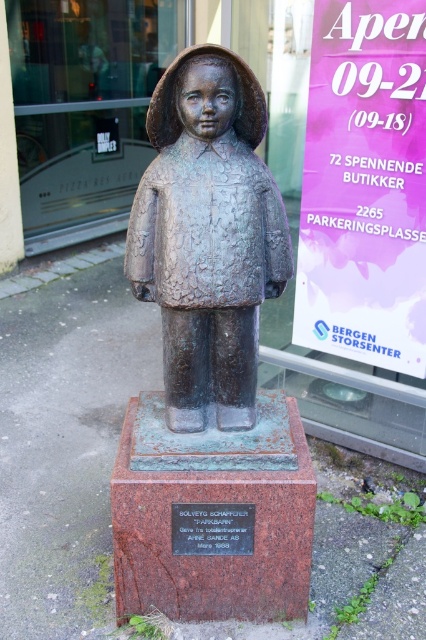
Is bronze statue at center behind bronze plaque at center?

No, bronze statue at center is in front of bronze plaque at center.

Does point (184, 369) come behind point (178, 515)?

Yes, point (184, 369) is farther from viewer.

Does point (196, 168) come farther from viewer compared to point (210, 512)?

That is False.

Where is `bronze statue at center`? This screenshot has width=426, height=640. bronze statue at center is located at coordinates (207, 236).